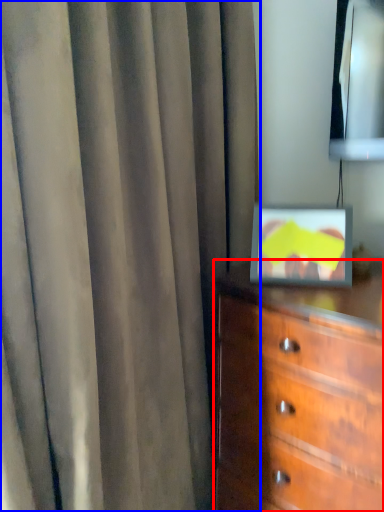
Question: Which object is further to the camera taking this photo, chest of drawers (highlighted by a red box) or curtain (highlighted by a blue box)?

Choices:
 (A) chest of drawers
 (B) curtain

Answer: (A)